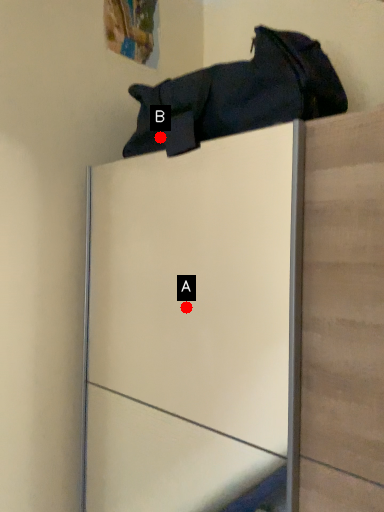
Question: Two points are circled on the image, labeled by A and B beside each circle. Which point is closer to the camera?

Choices:
 (A) A is closer
 (B) B is closer

Answer: (B)